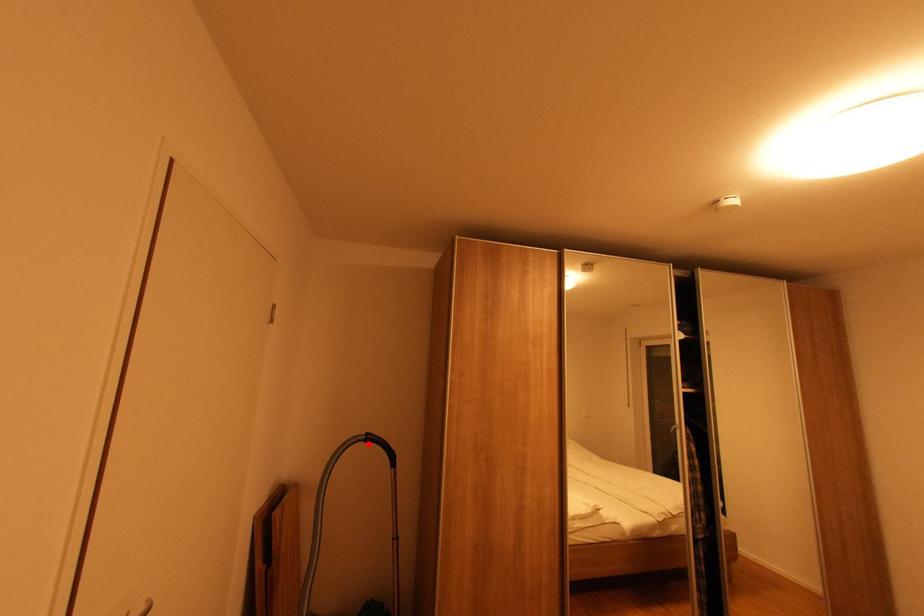
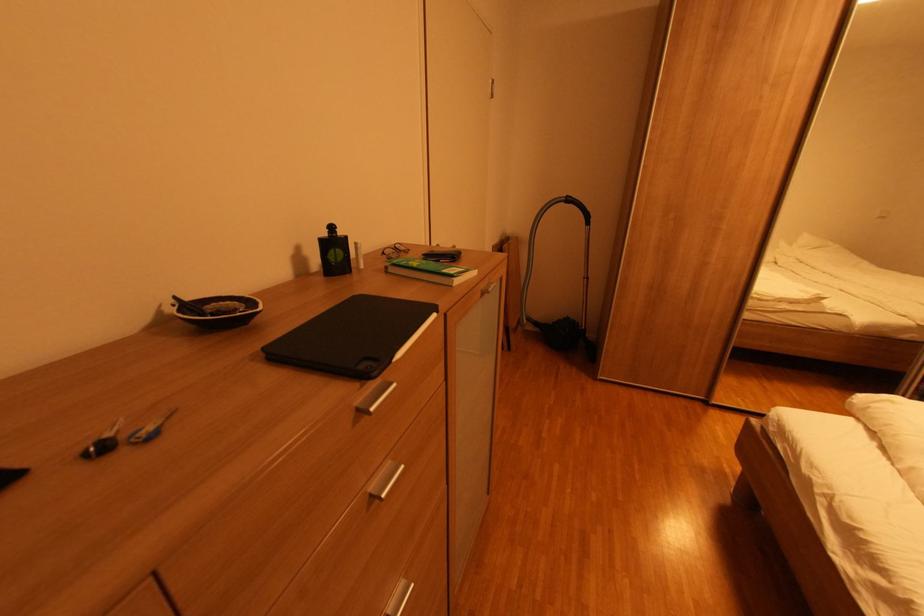
Question: I am providing you with two images of the same scene from different viewpoints. Given a red point in image1, look at the same physical point in image2. Is it:

Choices:
 (A) Closer to the viewpoint
 (B) Farther from the viewpoint

Answer: (A)